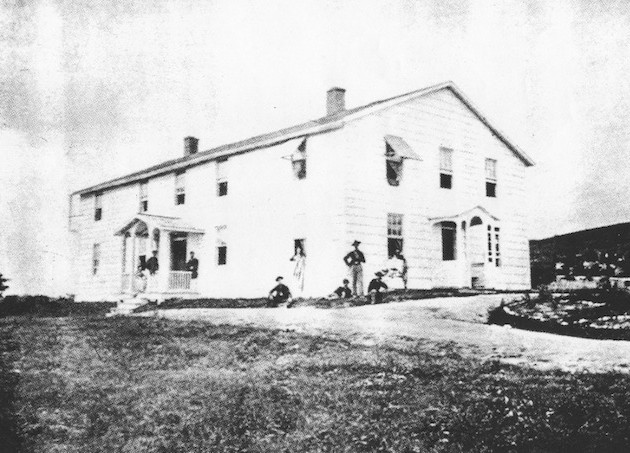
What are the coordinates of `door` in the screenshot? It's located at (445, 261), (184, 252).